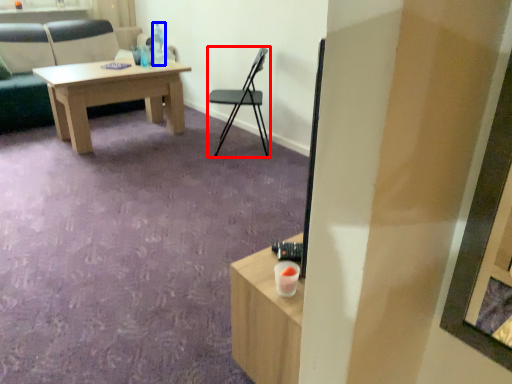
Question: Among these objects, which one is nearest to the camera, chair (highlighted by a red box) or bottle (highlighted by a blue box)?

Choices:
 (A) chair
 (B) bottle

Answer: (A)